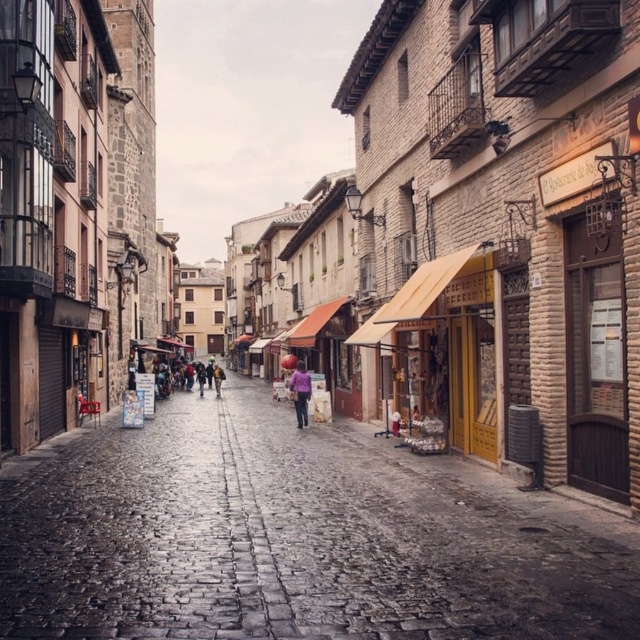
You are standing on the cobblestone street and want to walk towards the two points marked in the image. Which point, point (291, 387) or point (216, 380), will you reach first?

Point (291, 387) is closer to the viewer than point (216, 380), so you will reach point (291, 387) first.

You are standing at the entrance of the cobblestone street at center. If you walk straight ahead, which direction will you face relative to the tall tower on the left side?

Since the cobblestone street at center is located at coordinate point (294, 536), walking straight ahead along the street would lead you away from the tall tower on the left side. Therefore, you would be facing a direction opposite to the tall tower on the left side.

You are a tourist standing at the entrance of the narrow cobblestone street. You see a purple fabric at center and a dark purple sweater at center. Which one is positioned more to the right side of the street?

The purple fabric at center is positioned more to the right side of the street compared to the dark purple sweater at center.